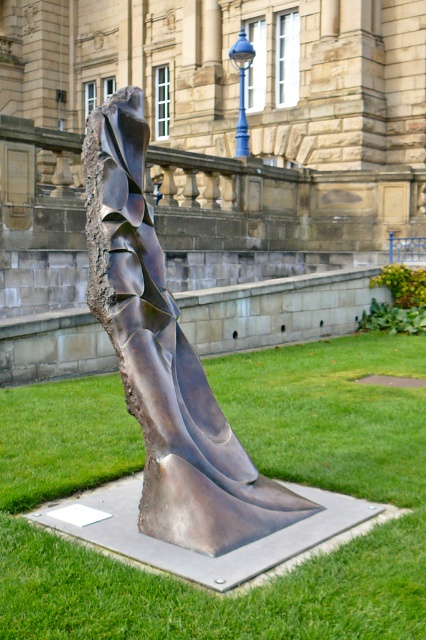
Which of these two, green grass at center or bronze sculpture at center, stands taller?

bronze sculpture at center is taller.

Can you confirm if green grass at center is smaller than bronze sculpture at center?

Yes, green grass at center is smaller than bronze sculpture at center.

The height and width of the screenshot is (640, 426). What do you see at coordinates (259, 468) in the screenshot?
I see `green grass at center` at bounding box center [259, 468].

Identify the location of green grass at center. (259, 468).